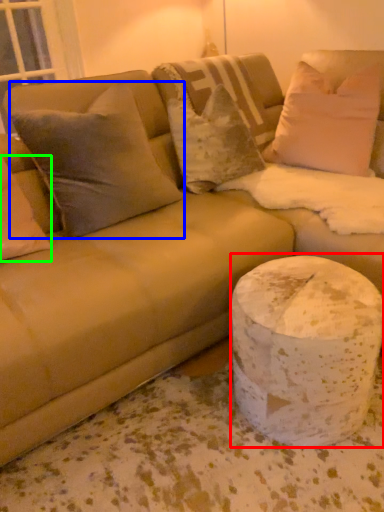
Question: Estimate the real-world distances between objects in this image. Which object is closer to marble (highlighted by a red box), pillow (highlighted by a blue box) or pillow (highlighted by a green box)?

Choices:
 (A) pillow
 (B) pillow

Answer: (A)